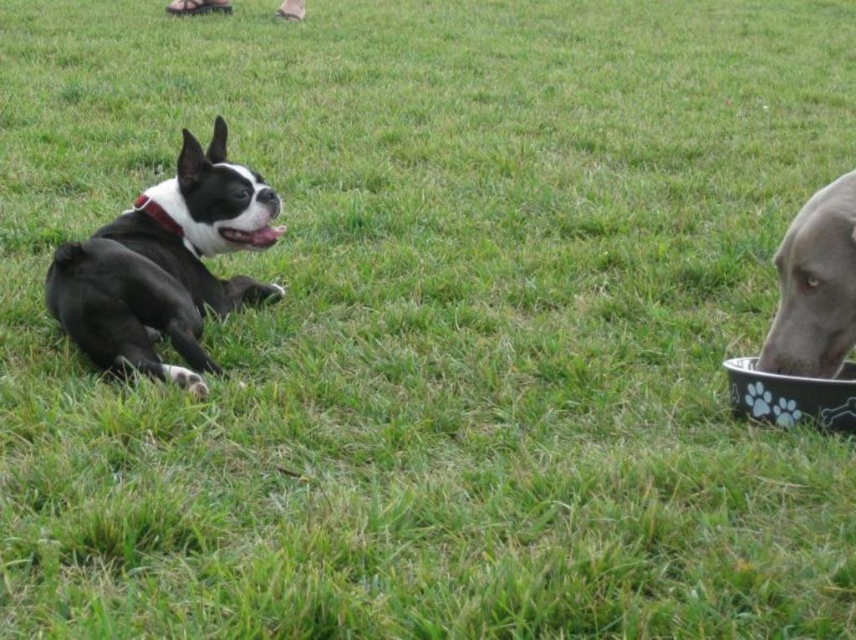
Question: Which object is positioned farthest from the gray matte bowl at right?

Choices:
 (A) black plastic bowl at right
 (B) black glossy dog at left

Answer: (B)

Question: Which object is farther from the camera taking this photo?

Choices:
 (A) gray matte bowl at right
 (B) black plastic bowl at right
 (C) black glossy dog at left

Answer: (C)

Question: From the image, what is the correct spatial relationship of gray matte bowl at right in relation to black plastic bowl at right?

Choices:
 (A) above
 (B) below

Answer: (A)

Question: Which point is closer to the camera taking this photo?

Choices:
 (A) (771, 403)
 (B) (260, 182)

Answer: (A)

Question: From the image, what is the correct spatial relationship of gray matte bowl at right in relation to black plastic bowl at right?

Choices:
 (A) left
 (B) right

Answer: (A)

Question: Is gray matte bowl at right below black plastic bowl at right?

Choices:
 (A) no
 (B) yes

Answer: (A)